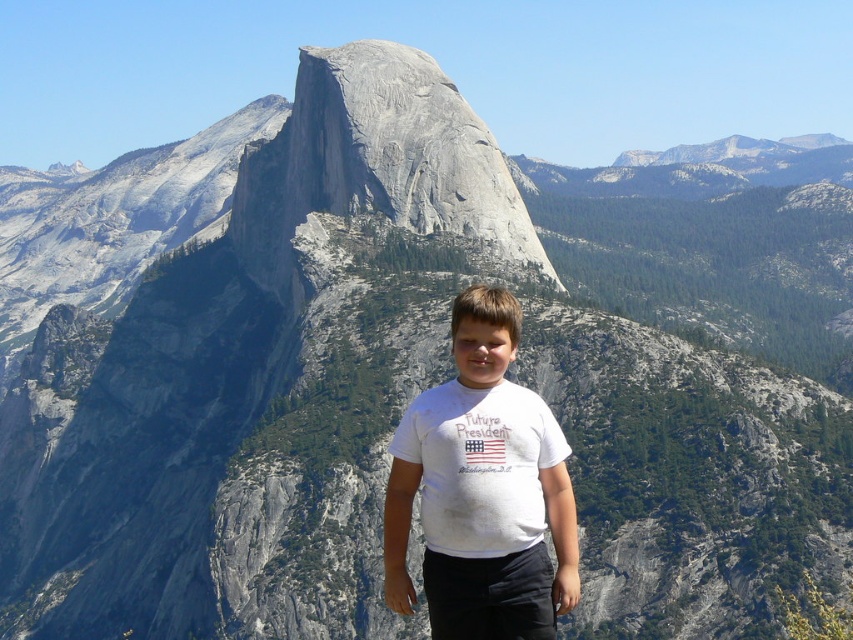
You are a photographer trying to capture the granite formation in the background. Where should you position yourself relative to the white cotton shirt at center to ensure the mountain is fully in frame?

The white cotton shirt at center is located at point [482,490]. To capture the granite formation in the background, position yourself to the left of the white cotton shirt at center so the mountain remains centered in your frame.

You are a photographer trying to capture the mountain view behind the person wearing the white T shirt at center. To ensure the white cotton shirt at center doesn not block the view, where should you position yourself relative to the point at (482, 490)?

The point at (482, 490) corresponds to the white cotton shirt at center. To avoid blocking the mountain view, position yourself to the side or behind this point so the shirt does not obstruct the background.

You are a photographer planning to take a photo of the white cotton shirt at center and the gray rock formation at center in the mountainous landscape. Based on their heights, which object should appear smaller in the photo?

The white cotton shirt at center has a lesser height compared to the gray rock formation at center, so it should appear smaller in the photo.